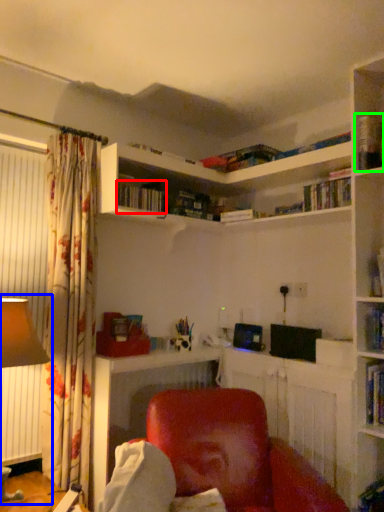
Question: Which object is positioned farthest from book (highlighted by a red box)? Select from table lamp (highlighted by a blue box) and book (highlighted by a green box).

Choices:
 (A) table lamp
 (B) book

Answer: (B)